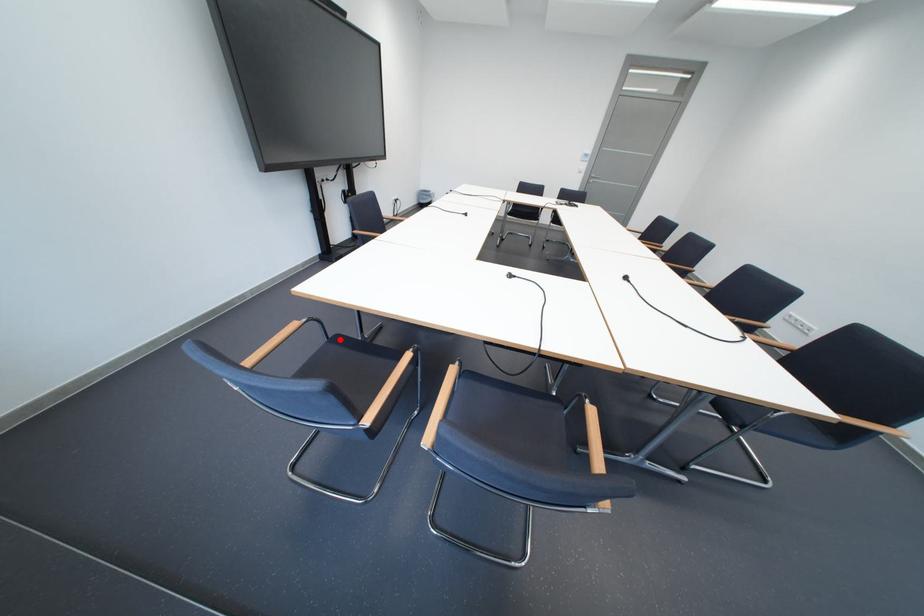
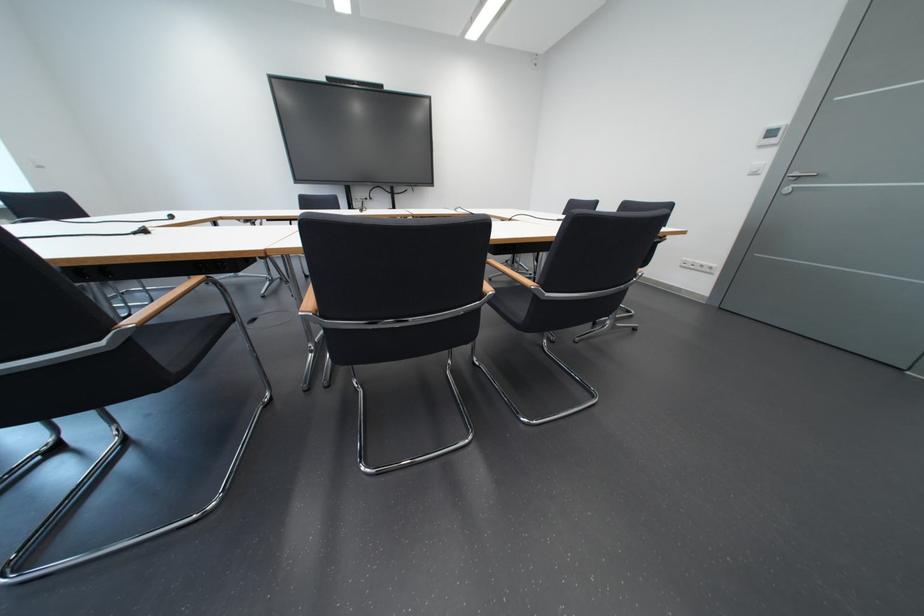
Question: I am providing you with two images of the same scene from different viewpoints. A red point is marked on the first image. Can you still see the location of the red point in image 2?

Choices:
 (A) Yes
 (B) No

Answer: (B)